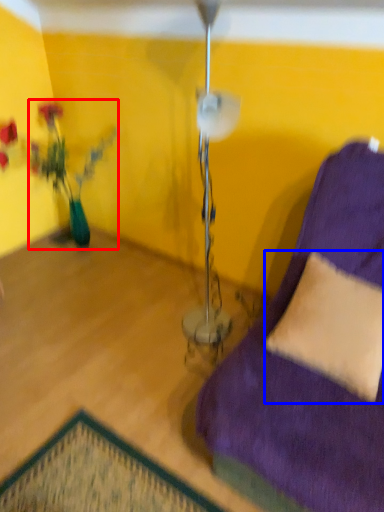
Question: Which object appears farthest to the camera in this image, houseplant (highlighted by a red box) or pillow (highlighted by a blue box)?

Choices:
 (A) houseplant
 (B) pillow

Answer: (A)